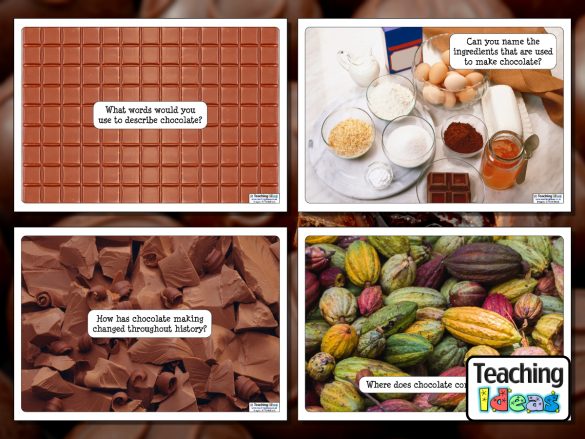
Identify the location of box. This screenshot has width=585, height=439. (402, 41).